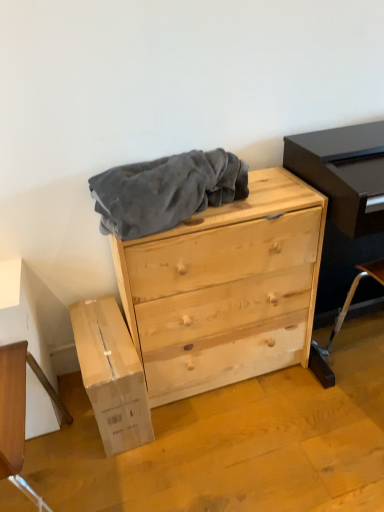
This screenshot has height=512, width=384. Find the location of `free spot above white cardboard box at lower left (from a real-world perspective)`. free spot above white cardboard box at lower left (from a real-world perspective) is located at coordinates (94, 331).